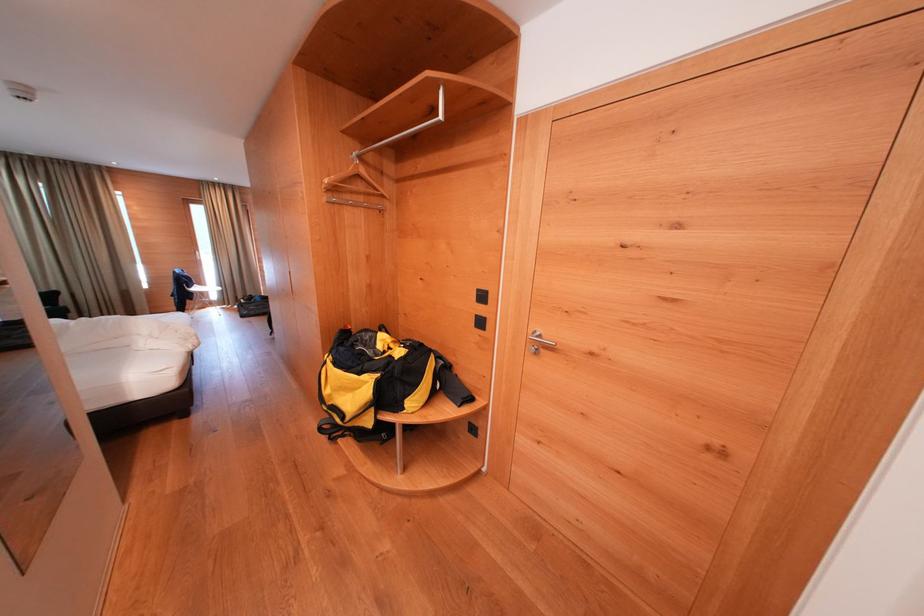
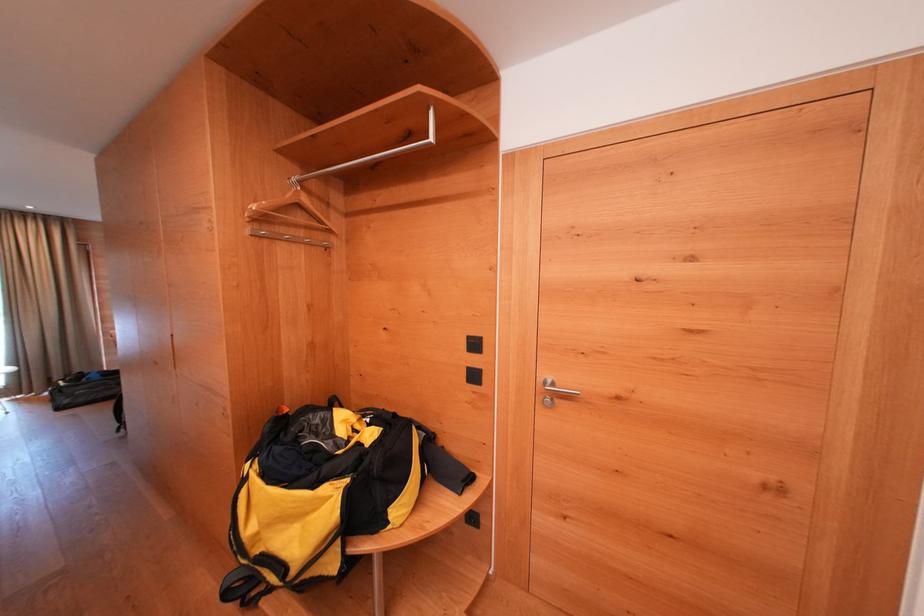
In the second image, find the point that corresponds to the point at 369,203 in the first image.

(308, 237)